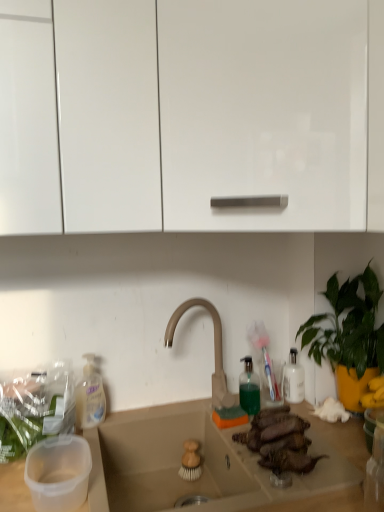
Question: Does brown matte meat at center turn towards glossy white cabinet at upper center, which is the 1th cabinetry from right to left?

Choices:
 (A) no
 (B) yes

Answer: (A)

Question: From the image's perspective, is brown matte meat at center under glossy white cabinet at upper center, the second cabinetry viewed from the left?

Choices:
 (A) no
 (B) yes

Answer: (B)

Question: Considering the relative positions of brown matte meat at center and glossy white cabinet at upper center, the second cabinetry viewed from the left, in the image provided, is brown matte meat at center behind glossy white cabinet at upper center, the second cabinetry viewed from the left,?

Choices:
 (A) yes
 (B) no

Answer: (A)

Question: Is brown matte meat at center to the left of glossy white cabinet at upper center, which is the 1th cabinetry from right to left, from the viewer's perspective?

Choices:
 (A) yes
 (B) no

Answer: (A)

Question: Can you confirm if brown matte meat at center is thinner than glossy white cabinet at upper center, the second cabinetry viewed from the left?

Choices:
 (A) yes
 (B) no

Answer: (A)

Question: Considering the positions of point [x=279, y=457] and point [x=110, y=117], is point [x=279, y=457] closer or farther from the camera than point [x=110, y=117]?

Choices:
 (A) closer
 (B) farther

Answer: (B)

Question: From the image's perspective, is brown matte meat at center above or below glossy white cabinet at upper center, the second cabinetry viewed from the left?

Choices:
 (A) below
 (B) above

Answer: (A)

Question: Is brown matte meat at center situated inside glossy white cabinet at upper center, the second cabinetry viewed from the left, or outside?

Choices:
 (A) inside
 (B) outside

Answer: (B)

Question: In the image, is brown matte meat at center on the left side or the right side of glossy white cabinet at upper center, which is the 1th cabinetry from right to left?

Choices:
 (A) left
 (B) right

Answer: (A)

Question: From the image's perspective, is green leafy plant at right positioned above or below beige matte faucet at center?

Choices:
 (A) below
 (B) above

Answer: (B)

Question: In terms of width, does green leafy plant at right look wider or thinner when compared to beige matte faucet at center?

Choices:
 (A) thin
 (B) wide

Answer: (B)

Question: Is point coord(340,391) closer or farther from the camera than point coord(223,384)?

Choices:
 (A) closer
 (B) farther

Answer: (B)

Question: Would you say green leafy plant at right is inside or outside beige matte faucet at center?

Choices:
 (A) inside
 (B) outside

Answer: (B)

Question: In terms of width, does glossy white cabinet at upper center, which is the 1th cabinetry from right to left, look wider or thinner when compared to beige matte faucet at center?

Choices:
 (A) thin
 (B) wide

Answer: (B)

Question: Considering the positions of glossy white cabinet at upper center, which is the 1th cabinetry from right to left, and beige matte faucet at center in the image, is glossy white cabinet at upper center, which is the 1th cabinetry from right to left, taller or shorter than beige matte faucet at center?

Choices:
 (A) short
 (B) tall

Answer: (B)